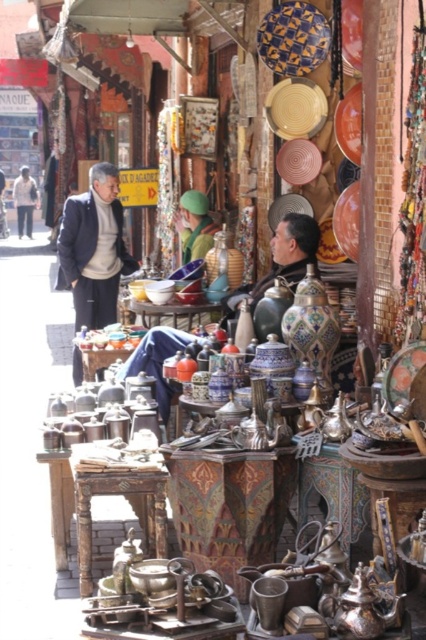
Question: Which point appears farthest from the camera in this image?

Choices:
 (A) (20, 173)
 (B) (118, 234)

Answer: (A)

Question: Which object is the closest to the white cotton jacket at left?

Choices:
 (A) dark gray suit at center
 (B) matte brown leather jacket at center

Answer: (A)

Question: Does matte brown leather jacket at center have a lesser width compared to white cotton jacket at left?

Choices:
 (A) yes
 (B) no

Answer: (B)

Question: Which object is the closest to the dark gray suit at center?

Choices:
 (A) white cotton jacket at left
 (B) matte brown leather jacket at center

Answer: (B)

Question: Can you confirm if matte brown leather jacket at center is positioned to the left of white cotton jacket at left?

Choices:
 (A) yes
 (B) no

Answer: (B)

Question: Is matte brown leather jacket at center positioned in front of white cotton jacket at left?

Choices:
 (A) no
 (B) yes

Answer: (B)